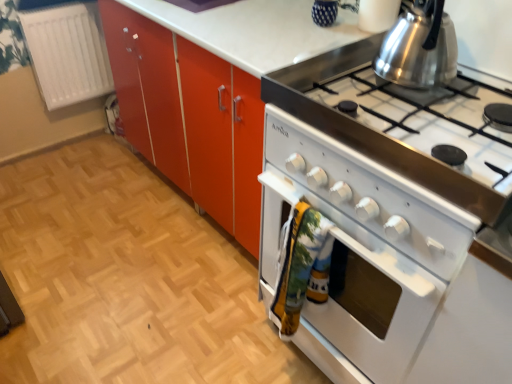
Question: Is point click(x=136, y=215) closer or farther from the camera than point click(x=62, y=6)?

Choices:
 (A) closer
 (B) farther

Answer: (B)

Question: In the image, is white glossy oven at lower right on the left side or the right side of white plastic radiator at left?

Choices:
 (A) left
 (B) right

Answer: (B)

Question: Estimate the real-world distances between objects in this image. Which object is farther from the white glossy oven at lower right?

Choices:
 (A) shiny metallic kettle at upper right
 (B) white glossy oven at right
 (C) white plastic radiator at left
 (D) white glossy stove at right

Answer: (A)

Question: Which object is the farthest from the white glossy stove at right?

Choices:
 (A) shiny metallic kettle at upper right
 (B) white plastic radiator at left
 (C) white glossy oven at lower right
 (D) white glossy oven at right

Answer: (B)